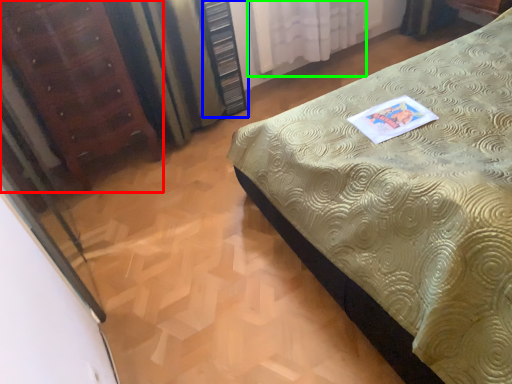
Question: Based on their relative distances, which object is nearer to furniture (highlighted by a red box)? Choose from dresser (highlighted by a blue box) and curtain (highlighted by a green box).

Choices:
 (A) dresser
 (B) curtain

Answer: (A)